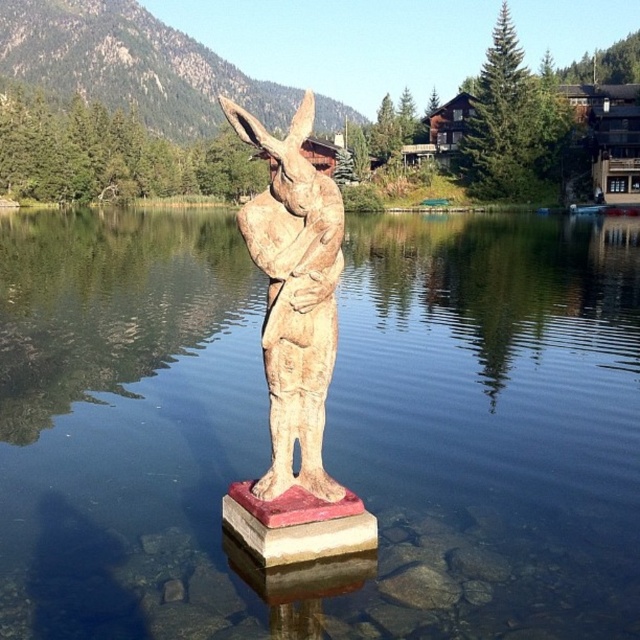
You are standing at the edge of the lake and want to take a photo of the wooden sculpture. To ensure the clear water at statue center is centered in your photo, where should you position your camera relative to the sculpture?

The clear water at statue center is located at the coordinates point (324, 426), so you should position your camera to focus on that point to center the clear water at statue center in your photo.